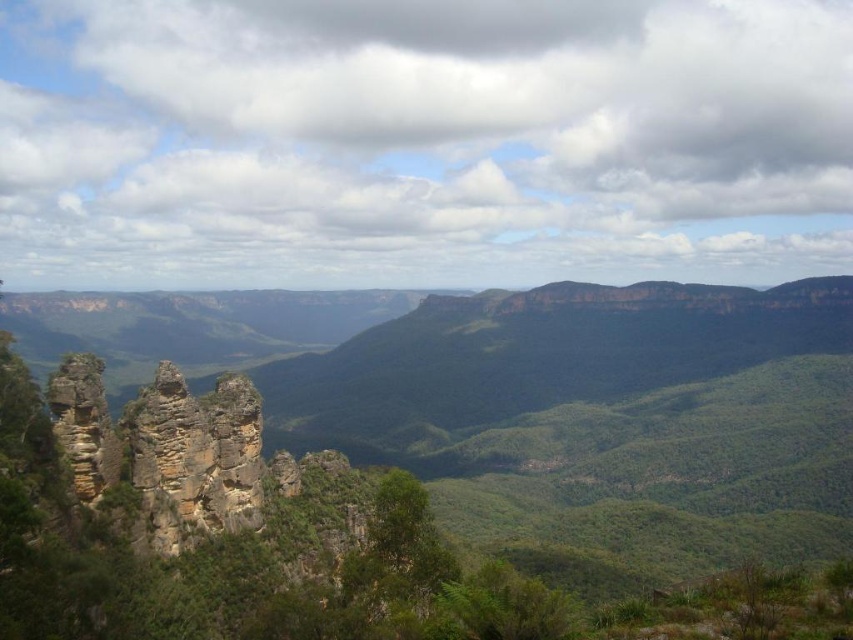
Question: Is rugged rock formation at center bigger than rugged stone rock formation at left?

Choices:
 (A) yes
 (B) no

Answer: (A)

Question: Which object is the closest to the white fluffy cloud at upper center?

Choices:
 (A) rugged rock formation at center
 (B) rugged stone rock formation at left

Answer: (A)

Question: Is white fluffy cloud at upper center closer to camera compared to rugged stone rock formation at left?

Choices:
 (A) yes
 (B) no

Answer: (B)

Question: Which is farther from the rugged stone rock formation at left?

Choices:
 (A) white fluffy cloud at upper center
 (B) rugged rock formation at center

Answer: (A)

Question: Which point appears closest to the camera in this image?

Choices:
 (A) (x=65, y=358)
 (B) (x=624, y=173)
 (C) (x=796, y=360)

Answer: (A)

Question: Can you confirm if rugged rock formation at center is wider than rugged stone rock formation at left?

Choices:
 (A) yes
 (B) no

Answer: (A)